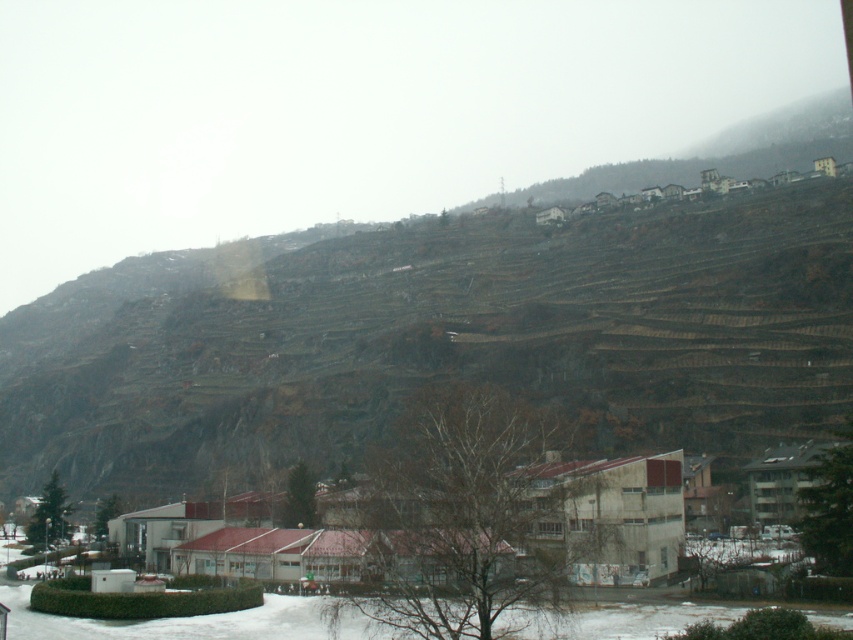
You are standing at the point marked by the coordinate point (614, 522) in the image. What is the nearest object to you in the scene?

The nearest object to you at point (614, 522) is the white concrete buildings at lower center, as the coordinate point directly represents this object.

You are a delivery drone that needs to pass between the white concrete buildings at lower center and the brown stone houses at upper right. Which structure has a narrower width to navigate through?

The white concrete buildings at lower center are thinner than the brown stone houses at upper right, so the narrower width to navigate through is the white concrete buildings at lower center.

You are standing at the point labeled point (582,179) and want to walk to the point labeled point (589,468). Which direction should you face to walk towards your destination?

You should face towards the direction away from the viewer because point (589,468) is closer to the viewer than point (582,179). Since you want to go from the farther point to the closer one, you need to walk towards the viewer.